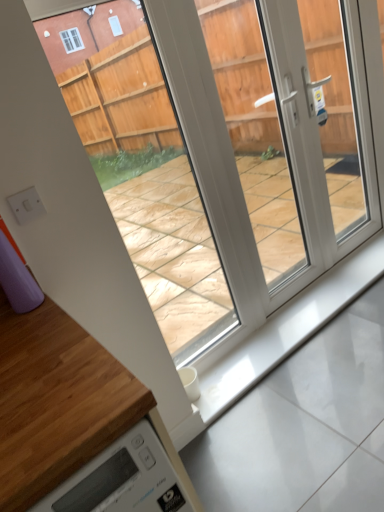
Question: From the image's perspective, does white glossy concrete at bottom appear lower than wooden at lower left?

Choices:
 (A) no
 (B) yes

Answer: (A)

Question: Is white glossy concrete at bottom looking in the opposite direction of wooden at lower left?

Choices:
 (A) yes
 (B) no

Answer: (B)

Question: Does white glossy concrete at bottom appear on the left side of wooden at lower left?

Choices:
 (A) no
 (B) yes

Answer: (A)

Question: Considering the relative sizes of white glossy concrete at bottom and wooden at lower left in the image provided, is white glossy concrete at bottom bigger than wooden at lower left?

Choices:
 (A) no
 (B) yes

Answer: (A)

Question: Could wooden at lower left be considered to be inside white glossy concrete at bottom?

Choices:
 (A) no
 (B) yes

Answer: (A)

Question: Considering the relative sizes of white glossy concrete at bottom and wooden at lower left in the image provided, is white glossy concrete at bottom shorter than wooden at lower left?

Choices:
 (A) yes
 (B) no

Answer: (A)

Question: Can you confirm if wooden at lower left is smaller than white glossy concrete at bottom?

Choices:
 (A) no
 (B) yes

Answer: (A)

Question: Is wooden at lower left bigger than white glossy concrete at bottom?

Choices:
 (A) no
 (B) yes

Answer: (B)

Question: From the image's perspective, is wooden at lower left located above white glossy concrete at bottom?

Choices:
 (A) yes
 (B) no

Answer: (B)

Question: Is white glossy concrete at bottom a part of wooden at lower left?

Choices:
 (A) yes
 (B) no

Answer: (B)

Question: Can you confirm if wooden at lower left is taller than white glossy concrete at bottom?

Choices:
 (A) no
 (B) yes

Answer: (B)

Question: Can you confirm if wooden at lower left is wider than white glossy concrete at bottom?

Choices:
 (A) no
 (B) yes

Answer: (B)

Question: From a real-world perspective, is transparent plastic glass door at center physically below wooden at lower left?

Choices:
 (A) no
 (B) yes

Answer: (A)